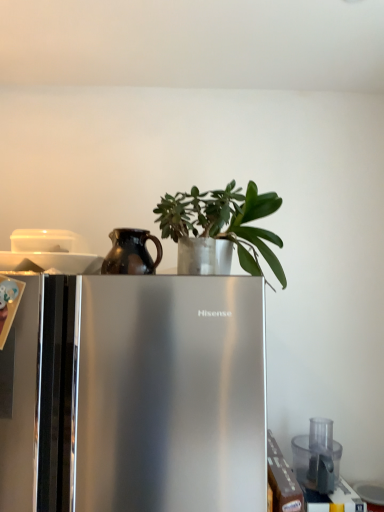
This screenshot has height=512, width=384. What do you see at coordinates (139, 395) in the screenshot? I see `satin silver refrigerator at center` at bounding box center [139, 395].

Locate an element on the screen. This screenshot has width=384, height=512. satin silver refrigerator at center is located at coordinates (139, 395).

What is the approximate width of green matte plant at center?

green matte plant at center is 10.73 inches wide.

Locate an element on the screen. The width and height of the screenshot is (384, 512). satin silver refrigerator at center is located at coordinates (139, 395).

Is point (97, 279) farther from camera compared to point (279, 240)?

That is False.

Is satin silver refrigerator at center turned away from green matte plant at center?

No, satin silver refrigerator at center is not facing the opposite direction of green matte plant at center.

From the picture: Which of these two, satin silver refrigerator at center or green matte plant at center, stands taller?

With more height is satin silver refrigerator at center.

Considering the positions of objects satin silver refrigerator at center and brown matte jug at upper left in the image provided, who is more to the left, satin silver refrigerator at center or brown matte jug at upper left?

satin silver refrigerator at center is more to the left.

From the image's perspective, is satin silver refrigerator at center above or below brown matte jug at upper left?

satin silver refrigerator at center is below brown matte jug at upper left.

Based on the photo, which of these two, transparent plastic food processor at lower right or satin silver refrigerator at center, is wider?

satin silver refrigerator at center is wider.

Is transparent plastic food processor at lower right turned away from satin silver refrigerator at center?

transparent plastic food processor at lower right does not have its back to satin silver refrigerator at center.

Locate an element on the screen. This screenshot has height=512, width=384. refrigerator that is in front of the transparent plastic food processor at lower right is located at coordinates (139, 395).

Does point (310, 426) come behind point (181, 195)?

Yes.

From a real-world perspective, between transparent plastic food processor at lower right and green matte plant at center, who is vertically higher?

In real-world perspective, green matte plant at center is above.

Can you tell me how much transparent plastic food processor at lower right and green matte plant at center differ in facing direction?

transparent plastic food processor at lower right and green matte plant at center are facing 1.91 degrees away from each other.

Considering the relative sizes of transparent plastic food processor at lower right and green matte plant at center in the image provided, is transparent plastic food processor at lower right bigger than green matte plant at center?

Actually, transparent plastic food processor at lower right might be smaller than green matte plant at center.

Could you tell me if green matte plant at center is facing brown matte jug at upper left?

No, green matte plant at center is not turned towards brown matte jug at upper left.

From a real-world perspective, does green matte plant at center sit lower than brown matte jug at upper left?

No, from a real-world perspective, green matte plant at center is not under brown matte jug at upper left.

Which object is wider, green matte plant at center or brown matte jug at upper left?

With larger width is green matte plant at center.

Considering the sizes of green matte plant at center and brown matte jug at upper left in the image, is green matte plant at center bigger or smaller than brown matte jug at upper left?

green matte plant at center is bigger than brown matte jug at upper left.

Does point (179, 197) lie behind point (135, 336)?

That is True.

Consider the image. Is green matte plant at center directly adjacent to satin silver refrigerator at center?

There is a gap between green matte plant at center and satin silver refrigerator at center.

Does green matte plant at center have a lesser height compared to satin silver refrigerator at center?

Yes, green matte plant at center is shorter than satin silver refrigerator at center.

From a real-world perspective, who is located lower, green matte plant at center or satin silver refrigerator at center?

From a 3D spatial view, satin silver refrigerator at center is below.

I want to click on refrigerator in front of the transparent plastic food processor at lower right, so click(139, 395).

What's the angular difference between satin silver refrigerator at center and transparent plastic food processor at lower right's facing directions?

1.17 degrees.

Could transparent plastic food processor at lower right be considered to be inside satin silver refrigerator at center?

No, satin silver refrigerator at center does not contain transparent plastic food processor at lower right.

Which of these two, satin silver refrigerator at center or transparent plastic food processor at lower right, stands shorter?

transparent plastic food processor at lower right is shorter.

In the image, there is a green matte plant at center. Where is `refrigerator below it (from a real-world perspective)`? This screenshot has width=384, height=512. refrigerator below it (from a real-world perspective) is located at coordinates (139, 395).

Locate an element on the screen. This screenshot has height=512, width=384. refrigerator in front of the brown matte jug at upper left is located at coordinates (139, 395).

Based on the photo, which object lies nearer to the anchor point brown matte jug at upper left, satin silver refrigerator at center or transparent plastic food processor at lower right?

satin silver refrigerator at center lies closer to brown matte jug at upper left than the other object.

Considering their positions, is brown matte jug at upper left positioned closer to transparent plastic food processor at lower right than satin silver refrigerator at center?

satin silver refrigerator at center is positioned closer to the anchor transparent plastic food processor at lower right.

Considering their positions, is brown matte jug at upper left positioned further to green matte plant at center than transparent plastic food processor at lower right?

transparent plastic food processor at lower right is positioned further to the anchor green matte plant at center.

Estimate the real-world distances between objects in this image. Which object is further from brown matte jug at upper left, satin silver refrigerator at center or green matte plant at center?

satin silver refrigerator at center lies further to brown matte jug at upper left than the other object.

From the image, which object appears to be nearer to green matte plant at center, satin silver refrigerator at center or brown matte jug at upper left?

Among the two, brown matte jug at upper left is located nearer to green matte plant at center.

Looking at the image, which one is located closer to brown matte jug at upper left, green matte plant at center or satin silver refrigerator at center?

Among the two, green matte plant at center is located nearer to brown matte jug at upper left.

Considering their positions, is transparent plastic food processor at lower right positioned further to brown matte jug at upper left than satin silver refrigerator at center?

transparent plastic food processor at lower right.

Looking at the image, which one is located closer to satin silver refrigerator at center, brown matte jug at upper left or green matte plant at center?

brown matte jug at upper left is positioned closer to the anchor satin silver refrigerator at center.

Identify the location of jug between green matte plant at center and satin silver refrigerator at center in the up-down direction. This screenshot has height=512, width=384. (131, 253).

At what (x,y) coordinates should I click in order to perform the action: click on refrigerator between green matte plant at center and transparent plastic food processor at lower right in the vertical direction. Please return your answer as a coordinate pair (x, y). Looking at the image, I should click on (139, 395).

The height and width of the screenshot is (512, 384). Find the location of `jug between satin silver refrigerator at center and transparent plastic food processor at lower right from left to right`. jug between satin silver refrigerator at center and transparent plastic food processor at lower right from left to right is located at coordinates (131, 253).

Locate an element on the screen. This screenshot has width=384, height=512. jug between green matte plant at center and transparent plastic food processor at lower right vertically is located at coordinates (131, 253).